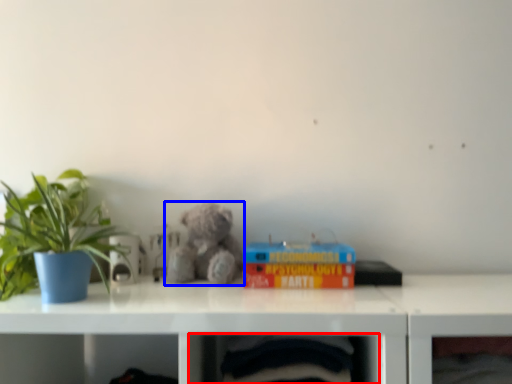
Question: Which object is closer to the camera taking this photo, shelf (highlighted by a red box) or teddy bear (highlighted by a blue box)?

Choices:
 (A) shelf
 (B) teddy bear

Answer: (A)